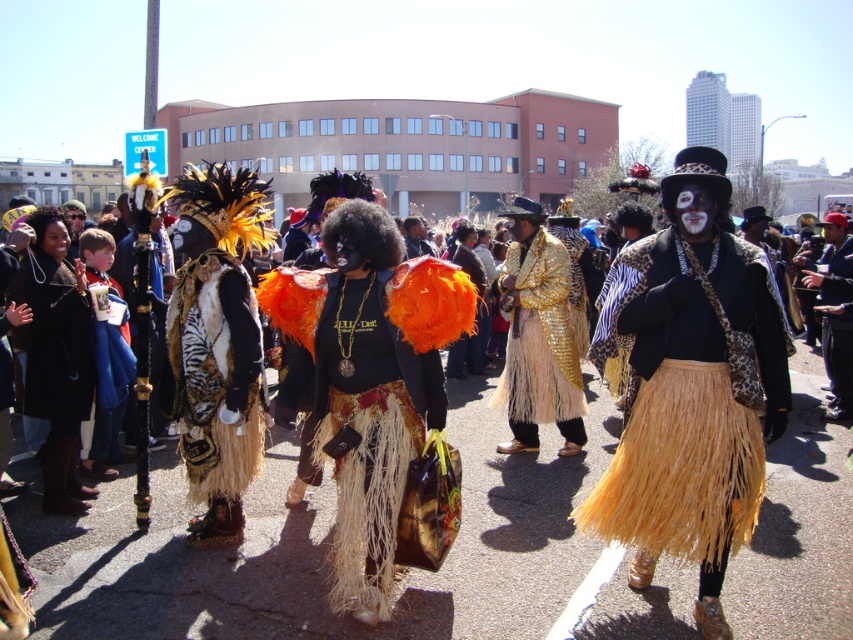
Consider the image. Between tiger print fur skirt at center and leopard print jacket at center, which one has more height?

With more height is leopard print jacket at center.

Is tiger print fur skirt at center closer to the viewer compared to leopard print jacket at center?

Yes.

Who is more forward, (190, 291) or (840, 259)?

Point (190, 291)

Locate an element on the screen. tiger print fur skirt at center is located at coordinates (216, 376).

Is gold sequined jacket at center wider than leopard print jacket at center?

Yes.

Which is below, gold sequined jacket at center or leopard print jacket at center?

gold sequined jacket at center is lower down.

Does point (538, 364) lie behind point (833, 275)?

No, (538, 364) is in front of (833, 275).

Locate an element on the screen. gold sequined jacket at center is located at coordinates (538, 340).

Is leopard print cape at center to the left of leopard print jacket at center from the viewer's perspective?

Indeed, leopard print cape at center is positioned on the left side of leopard print jacket at center.

This screenshot has height=640, width=853. What are the coordinates of `leopard print cape at center` in the screenshot? It's located at (692, 406).

What are the coordinates of `leopard print cape at center` in the screenshot? It's located at (692, 406).

I want to click on leopard print cape at center, so click(692, 406).